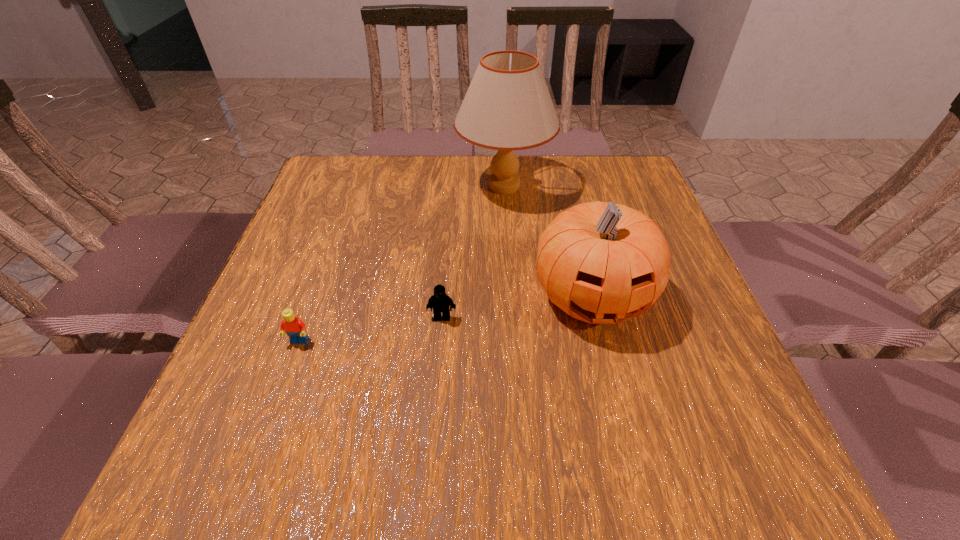
This screenshot has width=960, height=540. What are the coordinates of `the tallest object` in the screenshot? It's located at (507, 107).

This screenshot has width=960, height=540. Identify the location of lampshade. (507, 107).

The height and width of the screenshot is (540, 960). Identify the location of the second tallest object. (600, 262).

The width and height of the screenshot is (960, 540). I want to click on the right Lego, so click(x=440, y=302).

In order to click on the leftmost object in this screenshot , I will do `click(294, 327)`.

Find the location of a particular element. the nearer Lego is located at coordinates (294, 327).

Locate an element on the screen. Image resolution: width=960 pixels, height=540 pixels. vacant space located 0.190m on the front of the lampshade is located at coordinates (510, 267).

Find the location of a particular element. vacant position located on the front-facing side of the second tallest object is located at coordinates (619, 407).

Locate an element on the screen. This screenshot has height=540, width=960. vacant area located 0.130m on the face of the farther Lego is located at coordinates (437, 380).

Where is `free space located on the face of the leftmost object`? The height and width of the screenshot is (540, 960). free space located on the face of the leftmost object is located at coordinates (279, 396).